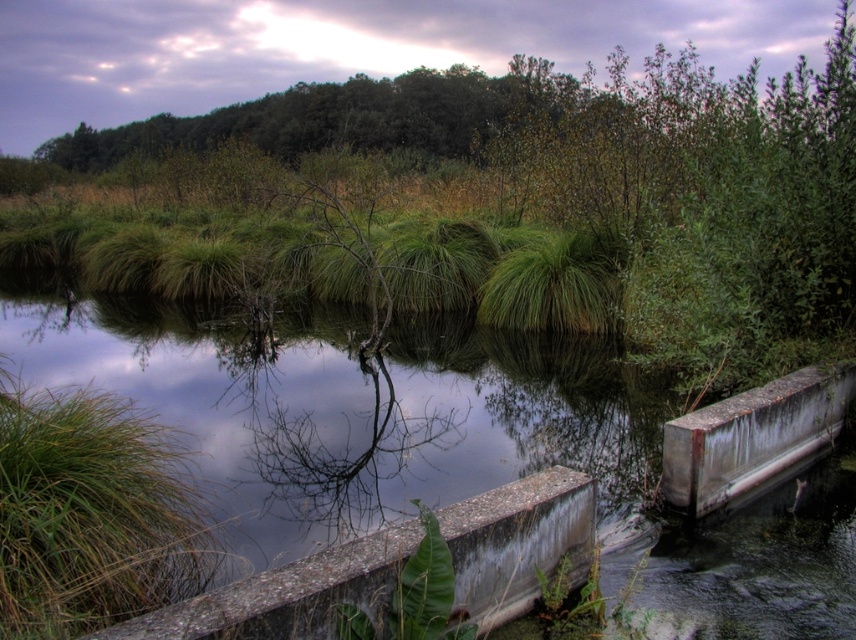
Is green grass at center shorter than concrete ledge at lower center?

No.

Which is in front, point (527, 273) or point (235, 588)?

Point (235, 588) is in front.

Is point (98, 266) farther from viewer compared to point (477, 497)?

That is True.

Identify the location of green grass at center. This screenshot has height=640, width=856. (685, 209).